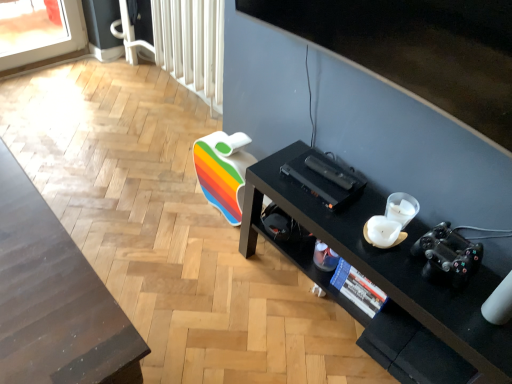
The width and height of the screenshot is (512, 384). In order to click on vacant point above shiny dark wood table at lower left (from a real-world perspective) in this screenshot , I will do `click(37, 279)`.